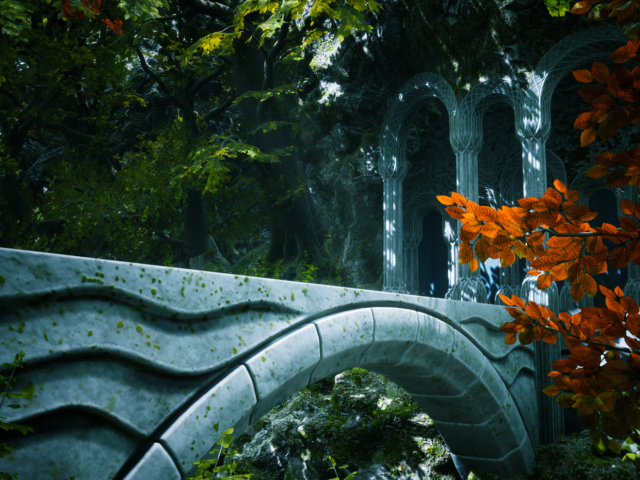
Find the location of a particular element. This screenshot has height=480, width=640. pillar is located at coordinates (380, 202), (470, 170), (529, 177).